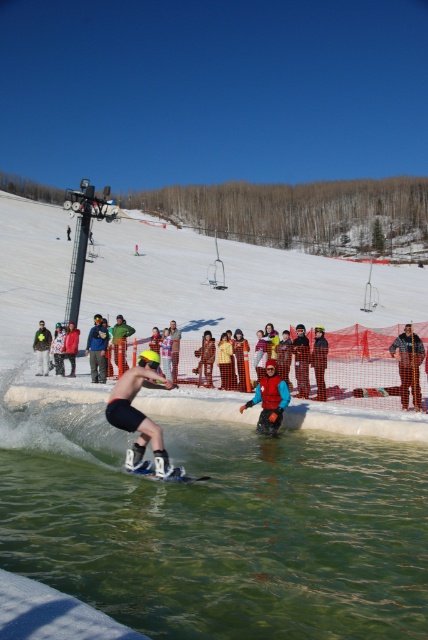
Question: Observing the image, what is the correct spatial positioning of clear water at center in reference to blue neoprene life vest at center?

Choices:
 (A) below
 (B) above

Answer: (A)

Question: Can you confirm if yellow knit hat at center is positioned to the left of red fabric jacket at center?

Choices:
 (A) no
 (B) yes

Answer: (B)

Question: Which of the following is the closest to the observer?

Choices:
 (A) clear water at center
 (B) red fabric jacket at center
 (C) blue neoprene life vest at center

Answer: (A)

Question: Which of these objects is positioned closest to the blue fabric jacket at center?

Choices:
 (A) blue neoprene life vest at center
 (B) blue plastic snowboard at center
 (C) clear water at center
 (D) white snow ski slope at center

Answer: (A)

Question: Does yellow knit hat at center lie behind blue plastic snowboard at center?

Choices:
 (A) no
 (B) yes

Answer: (B)

Question: Which object is closer to the camera taking this photo?

Choices:
 (A) matte black snowboard at center
 (B) blue plastic snowboard at center
 (C) blue neoprene life vest at center

Answer: (A)